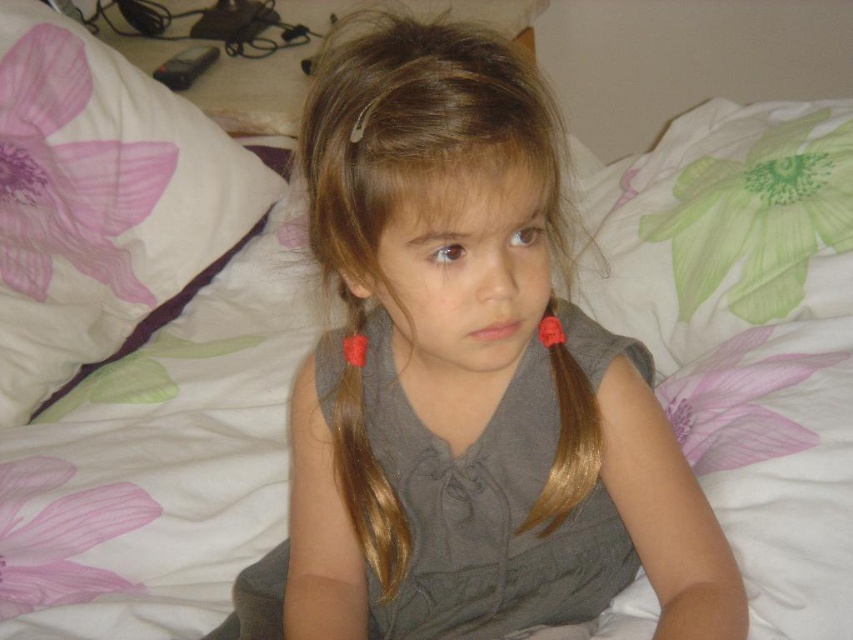
Identify the location of gray matte dress at center. (485, 515).

Is point (596, 552) more distant than point (379, 509)?

Yes.

Image resolution: width=853 pixels, height=640 pixels. Identify the location of gray matte dress at center. (485, 515).

Between white fabric pillow at upper left and golden smooth hair at center, which one is positioned higher?

white fabric pillow at upper left is higher up.

Does white fabric pillow at upper left have a greater width compared to golden smooth hair at center?

Yes.

The width and height of the screenshot is (853, 640). Find the location of `white fabric pillow at upper left`. white fabric pillow at upper left is located at coordinates (99, 200).

Which is more to the right, gray matte dress at center or golden smooth hair at center?

From the viewer's perspective, golden smooth hair at center appears more on the right side.

Is gray matte dress at center bigger than golden smooth hair at center?

Correct, gray matte dress at center is larger in size than golden smooth hair at center.

Measure the distance between point [485,557] and camera.

A distance of 27.85 inches exists between point [485,557] and camera.

This screenshot has height=640, width=853. Identify the location of gray matte dress at center. 485,515.